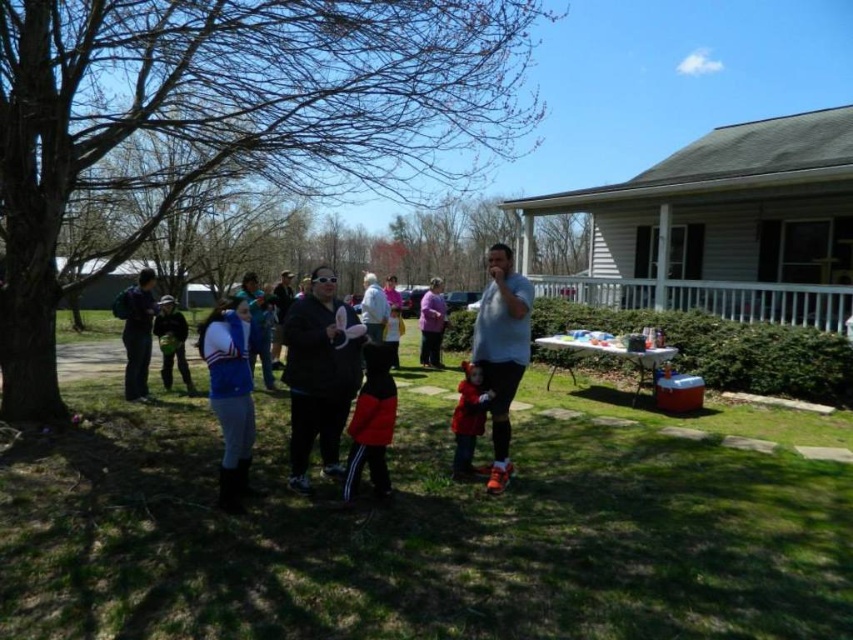
How much distance is there between dark blue jacket at left and dark blue jacket at center?

dark blue jacket at left is 4.03 feet from dark blue jacket at center.

Does dark blue jacket at left appear under dark blue jacket at center?

No, dark blue jacket at left is not below dark blue jacket at center.

Identify the location of dark blue jacket at left. (136, 332).

The height and width of the screenshot is (640, 853). Find the location of `dark blue jacket at left`. dark blue jacket at left is located at coordinates (136, 332).

Between dark blue jacket at center and white matte jacket at center, which one is positioned lower?

dark blue jacket at center is below.

Find the location of a particular element. The height and width of the screenshot is (640, 853). dark blue jacket at center is located at coordinates (171, 342).

Who is more distant from viewer, (292, 109) or (230, 385)?

The point (292, 109) is more distant.

Does brown bark tree at left appear on the left side of blue fleece jacket at center?

Correct, you'll find brown bark tree at left to the left of blue fleece jacket at center.

Identify the location of brown bark tree at left. (229, 120).

This screenshot has height=640, width=853. Find the location of `brown bark tree at left`. brown bark tree at left is located at coordinates (229, 120).